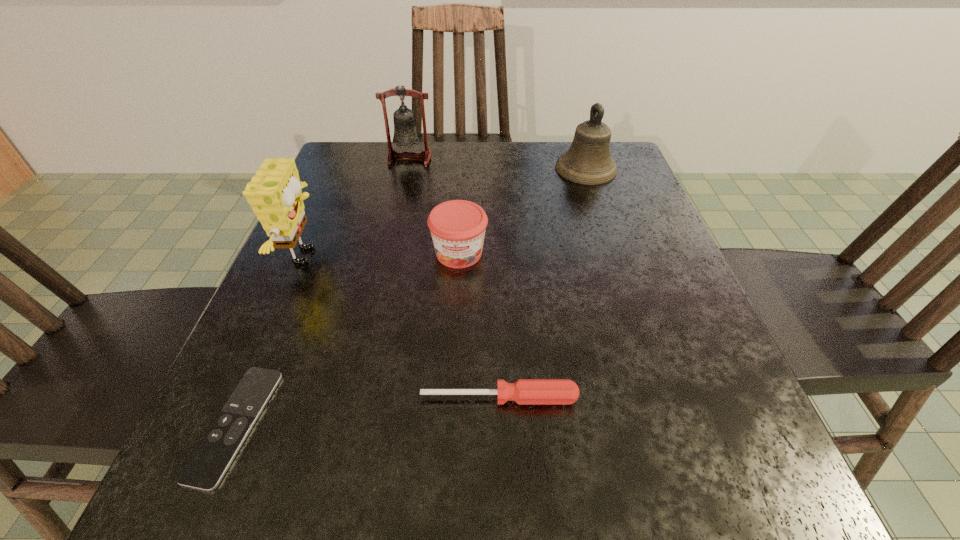
I want to click on empty space between the third object from left to right and the jam, so click(434, 206).

Where is `free spot between the third object from left to right and the sponge`? The height and width of the screenshot is (540, 960). free spot between the third object from left to right and the sponge is located at coordinates (358, 207).

Find the location of `vacant space that's between the sponge and the shortest object`. vacant space that's between the sponge and the shortest object is located at coordinates coord(271,340).

Identify the location of vacant space that's between the sponge and the screwdriver. This screenshot has height=540, width=960. (403, 327).

The image size is (960, 540). What are the coordinates of `free spot between the shortest object and the fifth tallest object` in the screenshot? It's located at (368, 411).

This screenshot has height=540, width=960. Identify the location of object that stands as the closest to the rightmost object. (457, 227).

Point out which object is positioned as the fifth nearest to the rightmost object. Please provide its 2D coordinates. Your answer should be formatted as a tuple, i.e. [(x, y)], where the tuple contains the x and y coordinates of a point satisfying the conditions above.

[(205, 468)]

The height and width of the screenshot is (540, 960). Find the location of `vacant region that satisfies the following two spatial constraints: 1. on the front-facing side of the sponge; 2. on the right side of the shortest object`. vacant region that satisfies the following two spatial constraints: 1. on the front-facing side of the sponge; 2. on the right side of the shortest object is located at coordinates (235, 424).

Identify the location of free space that satisfies the following two spatial constraints: 1. on the front label of the jam; 2. on the front-facing side of the sponge. The image size is (960, 540). (459, 256).

You are a GUI agent. You are given a task and a screenshot of the screen. Output one action in this format:
    pyautogui.click(x=<x>, y=<y>)
    Task: Click on the blank area in the image that satisfies the following two spatial constraints: 1. on the back side of the screwdriver; 2. on the left side of the rightmost object
    The height and width of the screenshot is (540, 960).
    Given the screenshot: What is the action you would take?
    pyautogui.click(x=492, y=168)